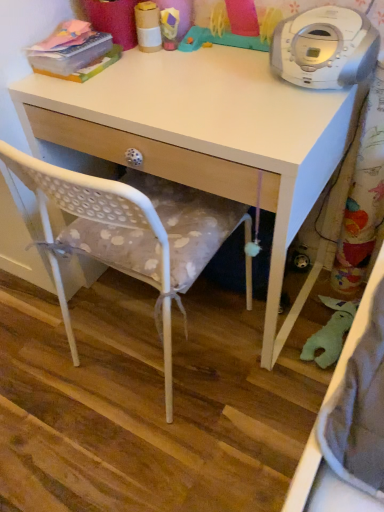
Question: Which direction should I rotate to face rubber duck at upper center, which is the first toy from right to left, — up or down?

Choices:
 (A) up
 (B) down

Answer: (A)

Question: Are cardboard tube at upper center, which is the 1th toy from left to right, and rubber duck at upper center, which is the first toy from right to left, making contact?

Choices:
 (A) yes
 (B) no

Answer: (B)

Question: Does cardboard tube at upper center, which is the 2th toy in right-to-left order, have a greater height compared to rubber duck at upper center, which ranks as the 2th toy in left-to-right order?

Choices:
 (A) no
 (B) yes

Answer: (A)

Question: Is cardboard tube at upper center, which is the 2th toy in right-to-left order, to the right of rubber duck at upper center, which ranks as the 2th toy in left-to-right order, from the viewer's perspective?

Choices:
 (A) yes
 (B) no

Answer: (B)

Question: From a real-world perspective, is cardboard tube at upper center, which is the 2th toy in right-to-left order, physically below rubber duck at upper center, which is the first toy from right to left?

Choices:
 (A) no
 (B) yes

Answer: (B)

Question: Can you confirm if cardboard tube at upper center, which is the 1th toy from left to right, is bigger than rubber duck at upper center, which ranks as the 2th toy in left-to-right order?

Choices:
 (A) yes
 (B) no

Answer: (B)

Question: Is rubber duck at upper center, which ranks as the 2th toy in left-to-right order, a part of cardboard tube at upper center, which is the 1th toy from left to right?

Choices:
 (A) no
 (B) yes

Answer: (A)

Question: From the image's perspective, is rubber duck at upper center, which is the first toy from right to left, located above white polka dot fabric chair at center?

Choices:
 (A) no
 (B) yes

Answer: (B)

Question: Can you confirm if rubber duck at upper center, which ranks as the 2th toy in left-to-right order, is shorter than white polka dot fabric chair at center?

Choices:
 (A) no
 (B) yes

Answer: (B)

Question: From the image's perspective, would you say rubber duck at upper center, which is the first toy from right to left, is shown under white polka dot fabric chair at center?

Choices:
 (A) yes
 (B) no

Answer: (B)

Question: Does rubber duck at upper center, which is the first toy from right to left, appear on the right side of white polka dot fabric chair at center?

Choices:
 (A) yes
 (B) no

Answer: (A)

Question: Is rubber duck at upper center, which is the first toy from right to left, not within white polka dot fabric chair at center?

Choices:
 (A) no
 (B) yes

Answer: (B)

Question: From a real-world perspective, is rubber duck at upper center, which is the first toy from right to left, physically above white polka dot fabric chair at center?

Choices:
 (A) no
 (B) yes

Answer: (B)

Question: From a real-world perspective, is rubber duck at upper center, which ranks as the 2th toy in left-to-right order, below white plastic cd player at upper right?

Choices:
 (A) yes
 (B) no

Answer: (A)